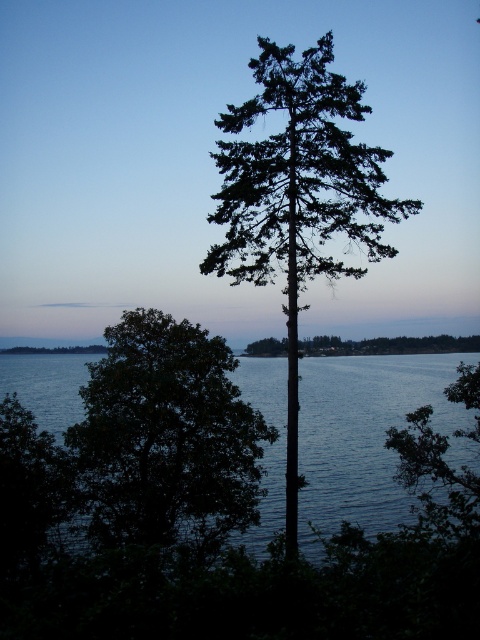
Is green leafy tree at center wider than green matte tree at center?

Incorrect, green leafy tree at center's width does not surpass green matte tree at center's.

In the scene shown: Which of these two, green leafy tree at center or green matte tree at center, stands taller?

Standing taller between the two is green matte tree at center.

This screenshot has height=640, width=480. In order to click on green leafy tree at center in this screenshot , I will do `click(167, 440)`.

Can you confirm if green leafy tree at center is positioned below green needle-like foliage at center?

Indeed, green leafy tree at center is positioned under green needle-like foliage at center.

The height and width of the screenshot is (640, 480). I want to click on green leafy tree at center, so click(x=167, y=440).

Between point (177, 348) and point (319, 156), which one is positioned in front?

Point (319, 156) is in front.

Find the location of a particular element. This screenshot has width=480, height=640. green leafy tree at center is located at coordinates (167, 440).

Is green needle-like foliage at center further to camera compared to green matte tree at center?

No, it is in front of green matte tree at center.

Which is more to the right, green needle-like foliage at center or green matte tree at center?

green matte tree at center is more to the right.

Which is in front, point (231, 252) or point (339, 349)?

Point (231, 252) is more forward.

This screenshot has height=640, width=480. I want to click on green needle-like foliage at center, so click(x=298, y=196).